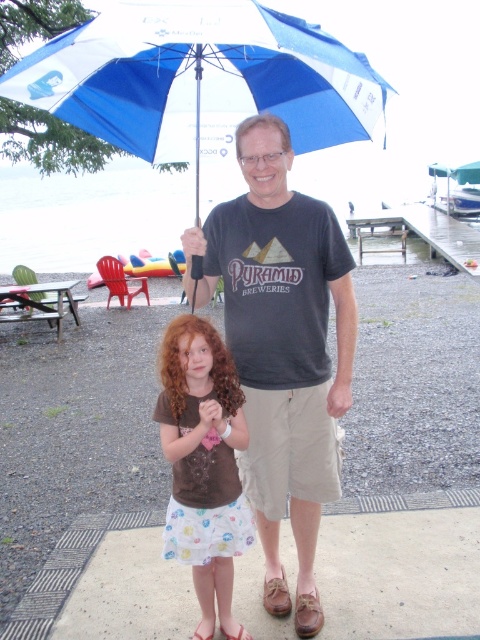
You are a photographer trying to capture a group photo of the two people and the picnic table. You need to ensure that the brown fabric shirt at center and the wooden picnic table at left are both visible in the frame. Based on their sizes, which object should be placed closer to the camera to ensure both are visible?

The brown fabric shirt at center is thinner than the wooden picnic table at left, so to ensure both are visible in the frame, the brown fabric shirt at center should be placed closer to the camera since it is smaller and requires less space.

What is located at the coordinates point (x=73, y=444)?

Concrete at center is located at point (x=73, y=444).